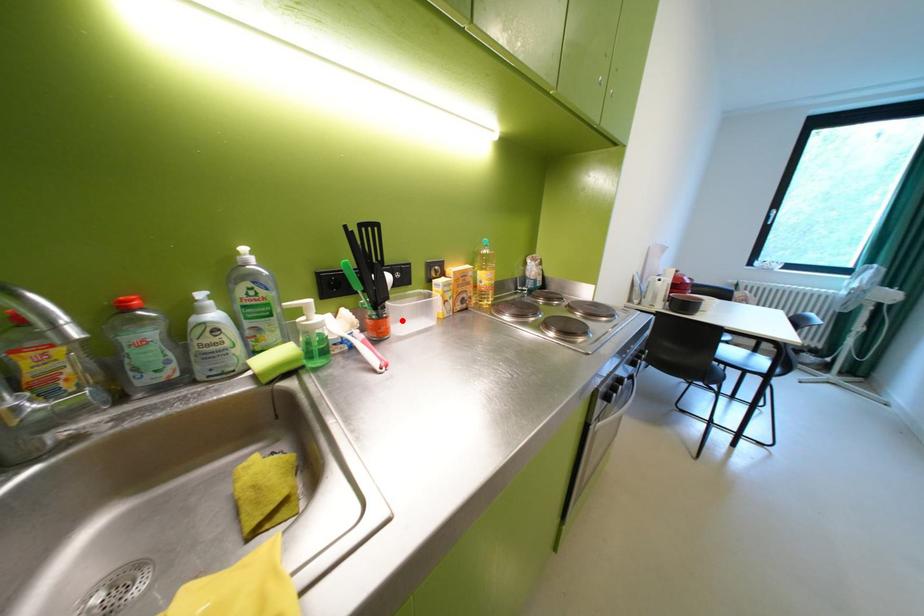
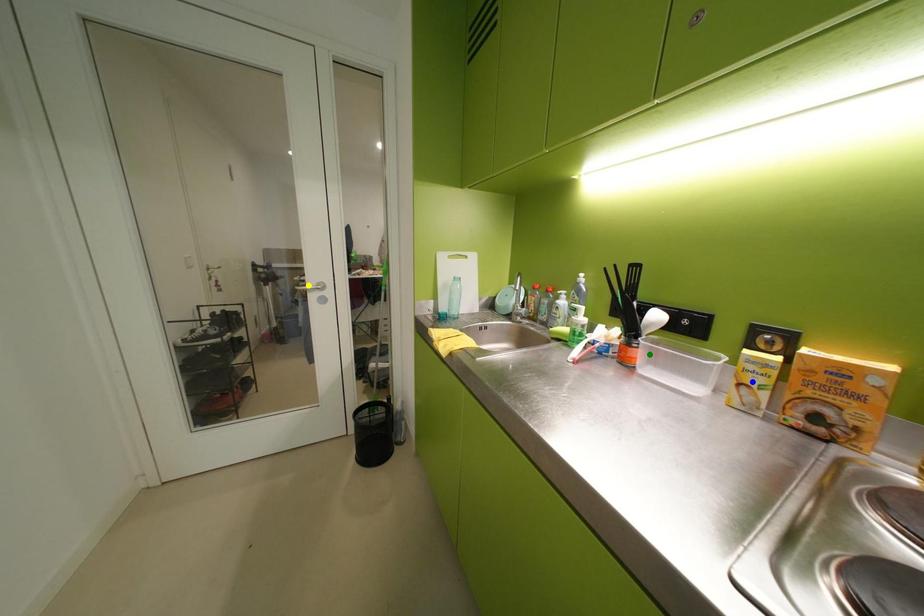
Question: I am providing you with two images of the same scene from different viewpoints. A red point is marked on the first image. You are given multiple points on the second image. Can you choose the point in image 2 that corresponds to the point in image 1?

Choices:
 (A) green point
 (B) yellow point
 (C) blue point

Answer: (A)